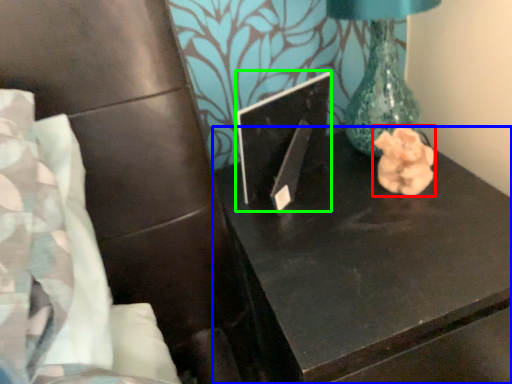
Question: Which is farther away from animal (highlighted by a red box)? table (highlighted by a blue box) or laptop (highlighted by a green box)?

Choices:
 (A) table
 (B) laptop

Answer: (B)